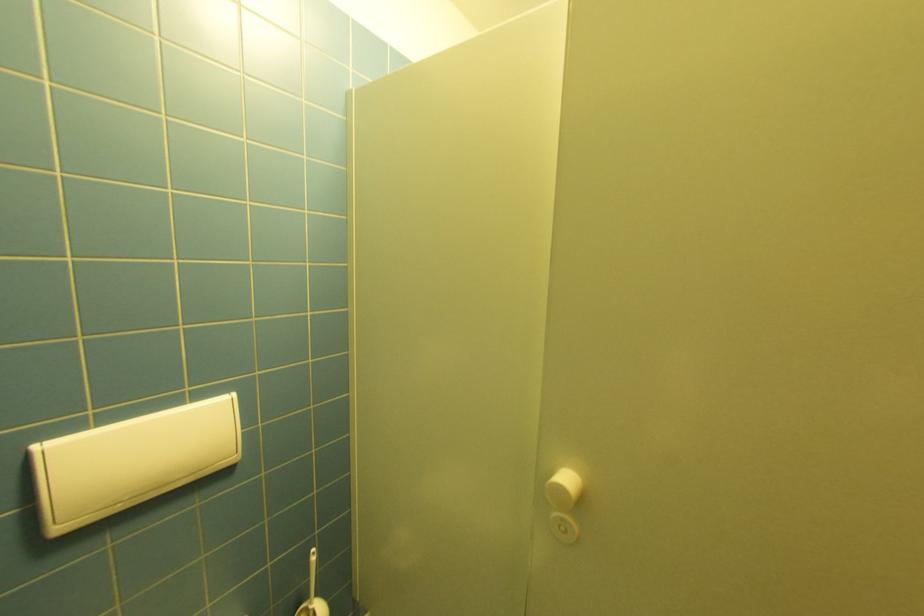
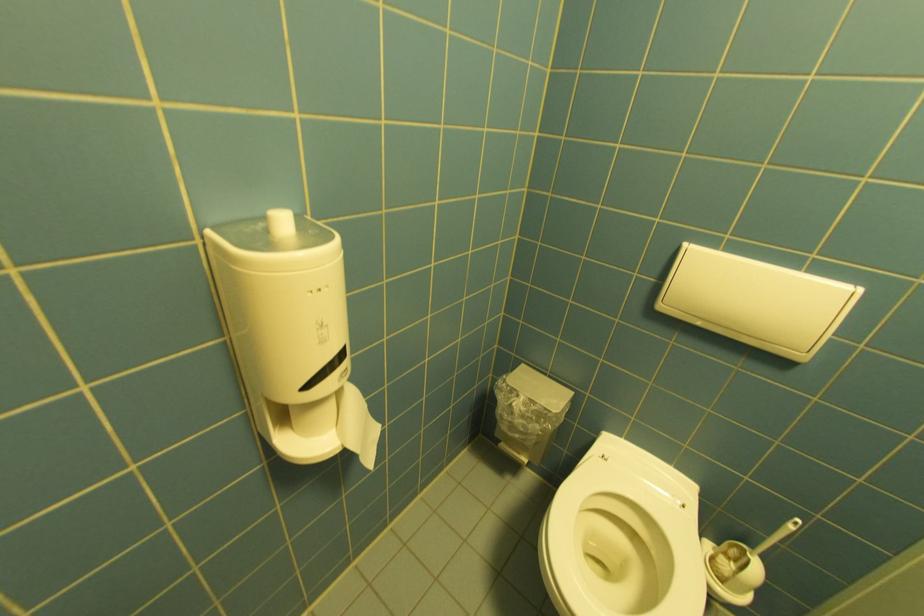
Based on the continuous images, in which direction is the camera rotating?

The rotation direction of the camera is left-down.